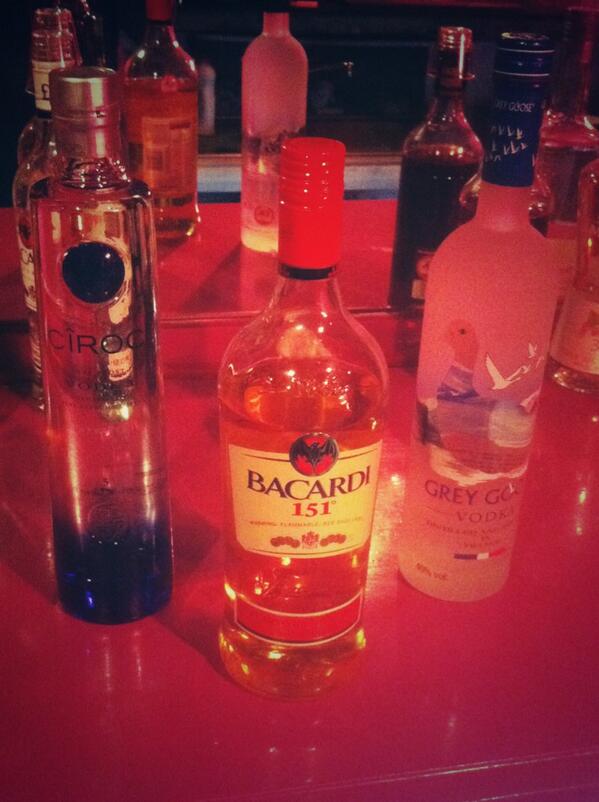
The width and height of the screenshot is (599, 802). I want to click on vodka bottle, so click(x=565, y=164).